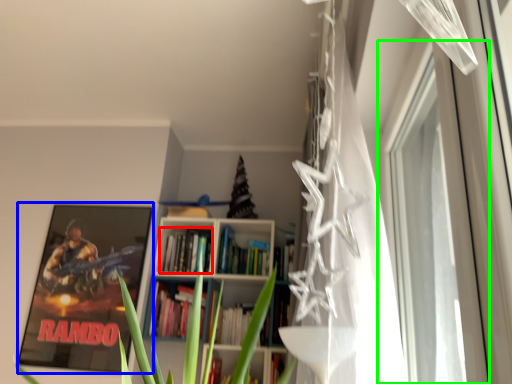
Question: Based on their relative distances, which object is farther from book (highlighted by a red box)? Choose from picture frame (highlighted by a blue box) and window (highlighted by a green box).

Choices:
 (A) picture frame
 (B) window

Answer: (B)